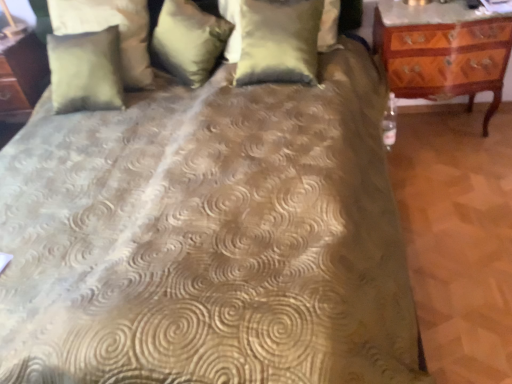
Question: Is point (444, 64) closer or farther from the camera than point (168, 52)?

Choices:
 (A) farther
 (B) closer

Answer: (B)

Question: From the image's perspective, is wooden carved nightstand at right positioned above or below satin gold pillow at upper center, which is counted as the 2th pillow, starting from the right?

Choices:
 (A) below
 (B) above

Answer: (A)

Question: Which object is positioned farthest from the satin gold pillow at center, placed as the first pillow when sorted from right to left?

Choices:
 (A) satin gold pillow at upper center, which is counted as the 2th pillow, starting from the right
 (B) suede-like beige pillow at upper left, the third pillow when ordered from right to left
 (C) wooden carved nightstand at right

Answer: (B)

Question: Considering the real-world distances, which object is farthest from the wooden carved nightstand at right?

Choices:
 (A) satin gold pillow at upper center, the second pillow positioned from the left
 (B) satin gold pillow at center, placed as the first pillow when sorted from right to left
 (C) suede-like beige pillow at upper left, arranged as the first pillow when viewed from the left

Answer: (C)